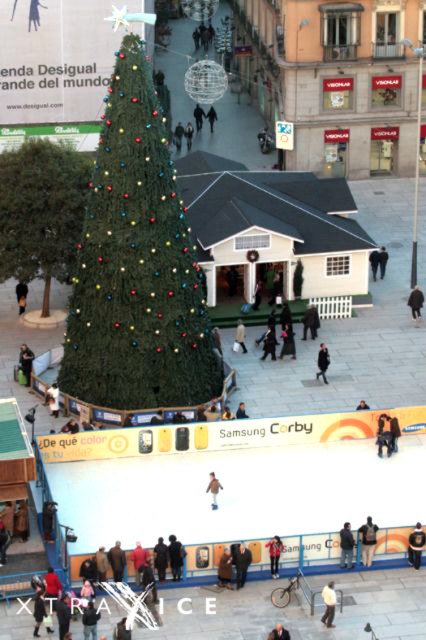
Question: Among these objects, which one is farthest from the camera?

Choices:
 (A) white cotton jacket at lower center
 (B) red leather jacket at lower center

Answer: (B)

Question: Is red leather jacket at lower center above black fabric coat at center?

Choices:
 (A) no
 (B) yes

Answer: (A)

Question: Which point appears closest to the camera in this image?

Choices:
 (A) (328, 620)
 (B) (270, 634)

Answer: (B)

Question: Among these objects, which one is farthest from the camera?

Choices:
 (A) brown fuzzy coat at center
 (B) dark gray jacket at center
 (C) white cotton jacket at lower center
 (D) red leather jacket at lower center

Answer: (B)

Question: Is dark brown leather jacket at lower center bigger than red leather jacket at lower center?

Choices:
 (A) no
 (B) yes

Answer: (A)

Question: Is red leather jacket at lower center below dark gray jacket at center?

Choices:
 (A) yes
 (B) no

Answer: (A)